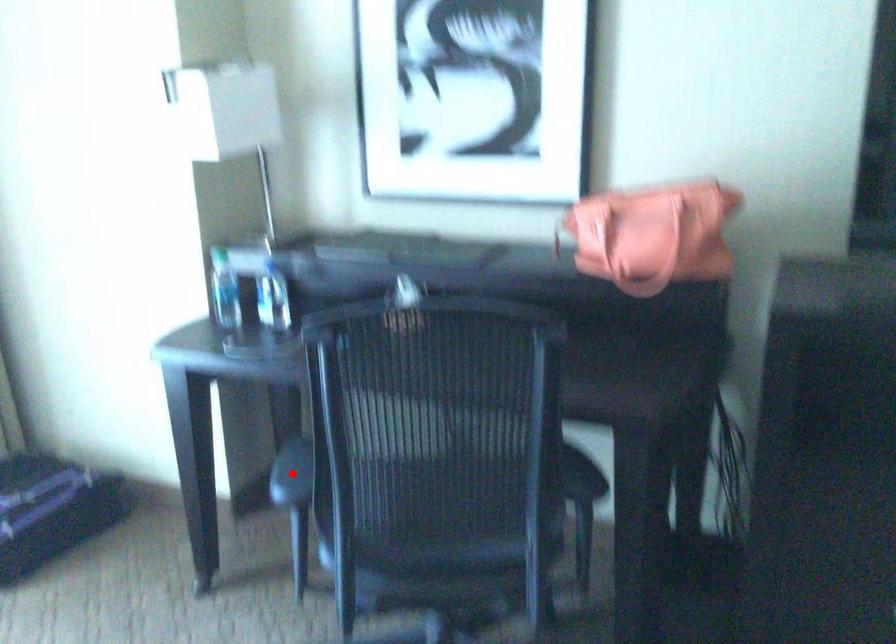
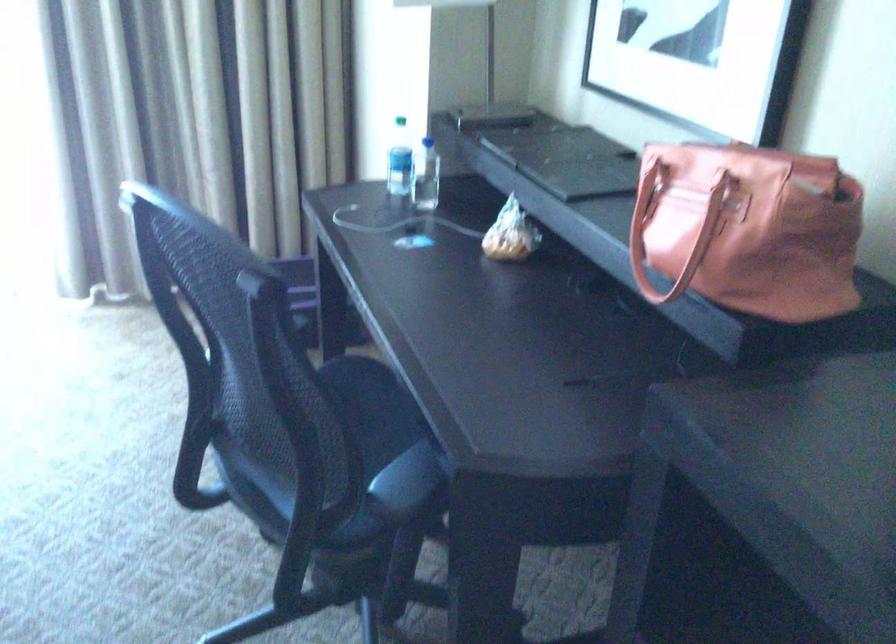
Question: I am providing you with two images of the same scene from different viewpoints. A red point is marked on the first image. Can you still see the location of the red point in image 2?

Choices:
 (A) Yes
 (B) No

Answer: (B)